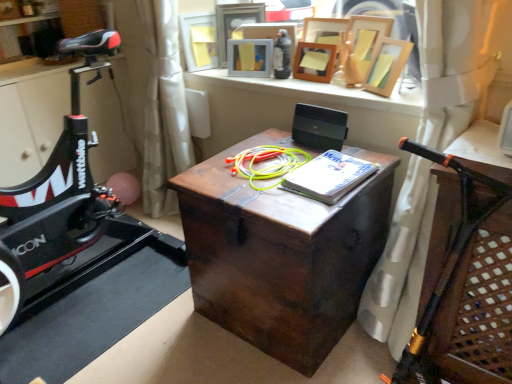
Question: Does wooden table at right have a greater width compared to wooden picture frame at upper center, which appears as the sixth picture frame when viewed from the left?

Choices:
 (A) yes
 (B) no

Answer: (A)

Question: Is wooden table at right aimed at wooden picture frame at upper center, which appears as the sixth picture frame when viewed from the left?

Choices:
 (A) no
 (B) yes

Answer: (A)

Question: Is wooden table at right at the left side of wooden picture frame at upper center, which appears as the first picture frame when viewed from the right?

Choices:
 (A) yes
 (B) no

Answer: (A)

Question: Does wooden table at right come behind wooden picture frame at upper center, which appears as the sixth picture frame when viewed from the left?

Choices:
 (A) yes
 (B) no

Answer: (B)

Question: From the image's perspective, is wooden table at right below wooden picture frame at upper center, which appears as the first picture frame when viewed from the right?

Choices:
 (A) no
 (B) yes

Answer: (B)

Question: Can you confirm if wooden table at right is thinner than wooden picture frame at upper center, which appears as the first picture frame when viewed from the right?

Choices:
 (A) no
 (B) yes

Answer: (A)

Question: Would you say dark wood trunk at center is part of wooden picture frame at upper center, marked as the 3th picture frame in a right-to-left arrangement,'s contents?

Choices:
 (A) no
 (B) yes

Answer: (A)

Question: Is wooden picture frame at upper center, marked as the fourth picture frame in a left-to-right arrangement, positioned far away from dark wood trunk at center?

Choices:
 (A) no
 (B) yes

Answer: (A)

Question: From a real-world perspective, is wooden picture frame at upper center, marked as the 3th picture frame in a right-to-left arrangement, positioned under dark wood trunk at center based on gravity?

Choices:
 (A) no
 (B) yes

Answer: (A)

Question: Can you confirm if wooden picture frame at upper center, marked as the 3th picture frame in a right-to-left arrangement, is positioned to the right of dark wood trunk at center?

Choices:
 (A) yes
 (B) no

Answer: (A)

Question: Is wooden picture frame at upper center, marked as the fourth picture frame in a left-to-right arrangement, facing away from dark wood trunk at center?

Choices:
 (A) yes
 (B) no

Answer: (B)

Question: Considering the relative sizes of wooden picture frame at upper center, marked as the 3th picture frame in a right-to-left arrangement, and dark wood trunk at center in the image provided, is wooden picture frame at upper center, marked as the 3th picture frame in a right-to-left arrangement, taller than dark wood trunk at center?

Choices:
 (A) yes
 (B) no

Answer: (B)

Question: Can you confirm if wooden picture frame at upper center, which is the first picture frame in left-to-right order, is taller than wooden table at right?

Choices:
 (A) yes
 (B) no

Answer: (B)